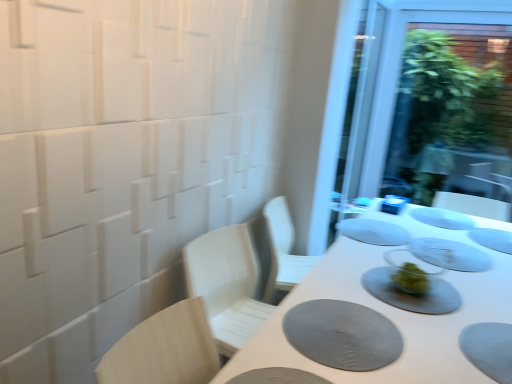
Find the location of `vacant area in front of matte white plate at center, the 4th tableware when ordered from front to back`. vacant area in front of matte white plate at center, the 4th tableware when ordered from front to back is located at coordinates (372, 256).